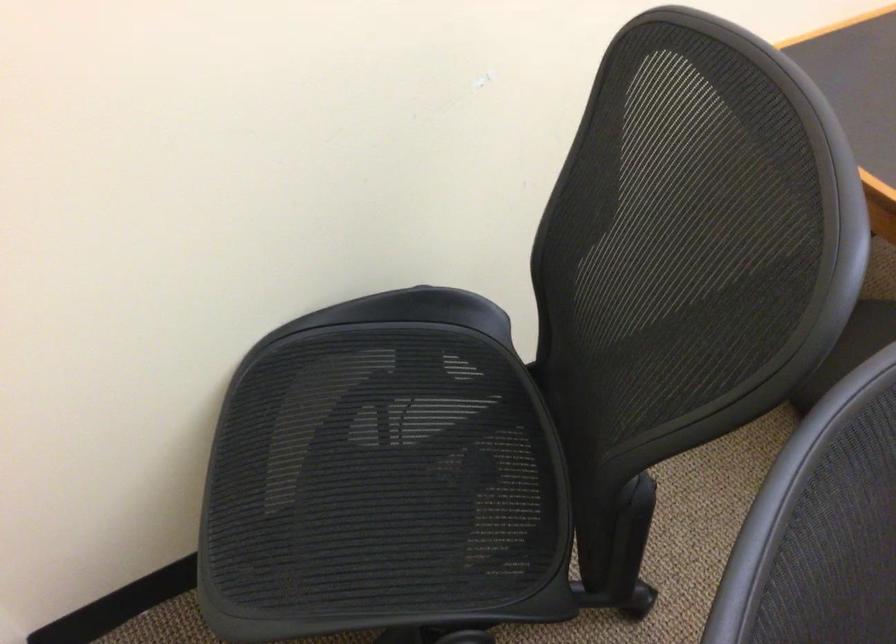
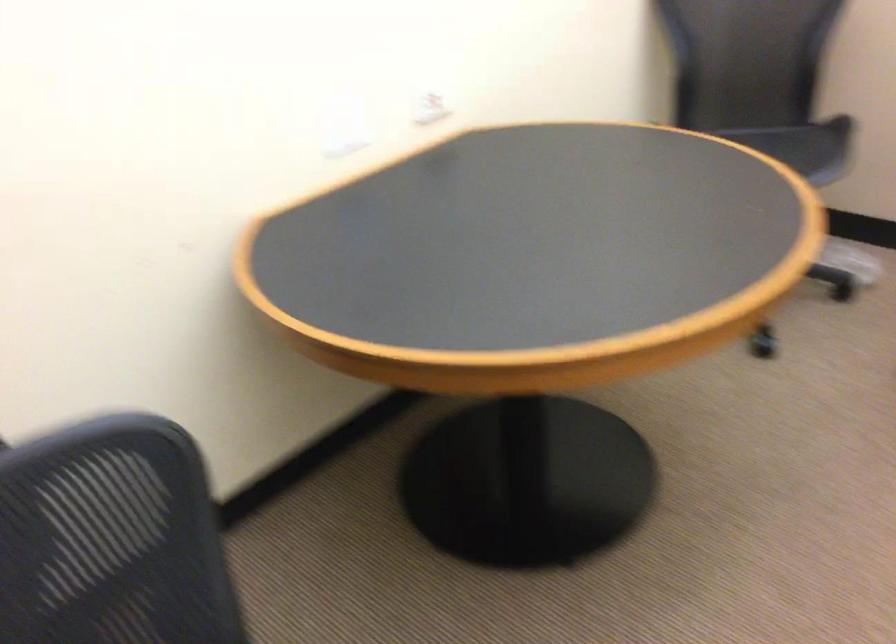
Question: Which direction would the cameraman need to move to produce the second image? Reply with the corresponding letter.

Choices:
 (A) Left
 (B) Right
 (C) Forward
 (D) Backward

Answer: (B)